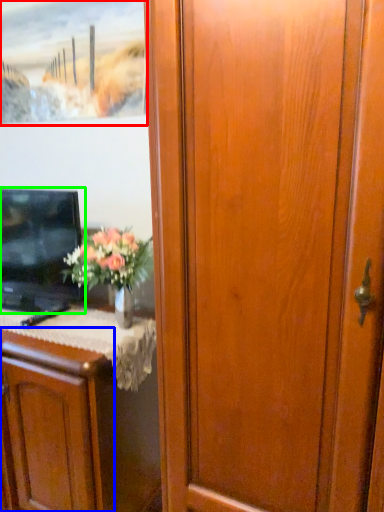
Question: Which is farther away from picture frame (highlighted by a red box)? cabinetry (highlighted by a blue box) or television (highlighted by a green box)?

Choices:
 (A) cabinetry
 (B) television

Answer: (A)